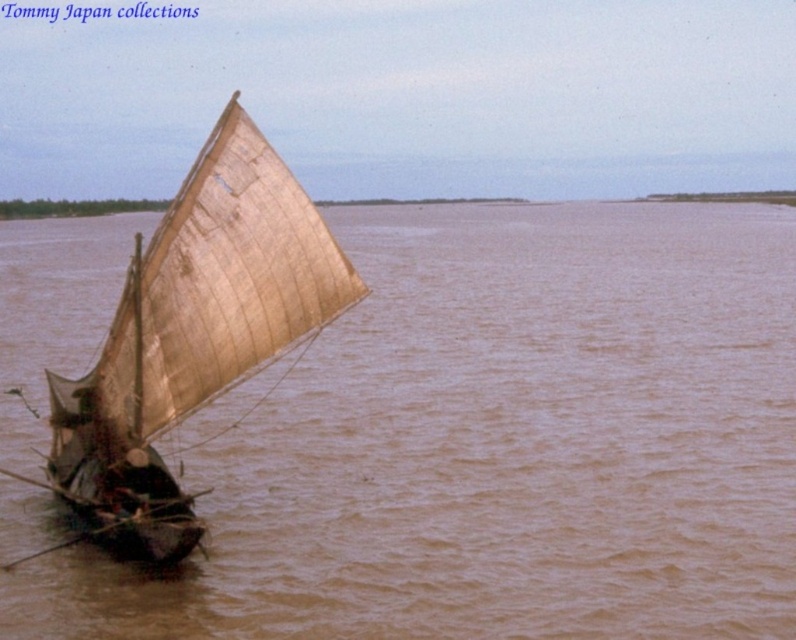
Question: Can you confirm if brown muddy water at center is smaller than light brown canvas sailboat at left?

Choices:
 (A) yes
 (B) no

Answer: (B)

Question: Considering the relative positions of brown muddy water at center and light brown canvas sailboat at left in the image provided, where is brown muddy water at center located with respect to light brown canvas sailboat at left?

Choices:
 (A) left
 (B) right

Answer: (B)

Question: Is brown muddy water at center behind light brown canvas sailboat at left?

Choices:
 (A) no
 (B) yes

Answer: (B)

Question: Which object appears closest to the camera in this image?

Choices:
 (A) brown muddy water at center
 (B) light brown canvas sailboat at left

Answer: (B)